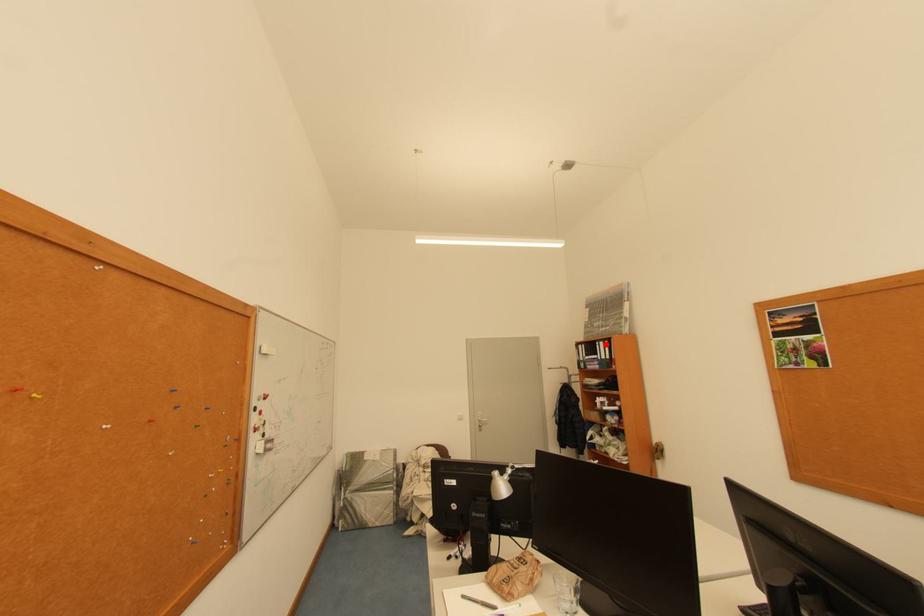
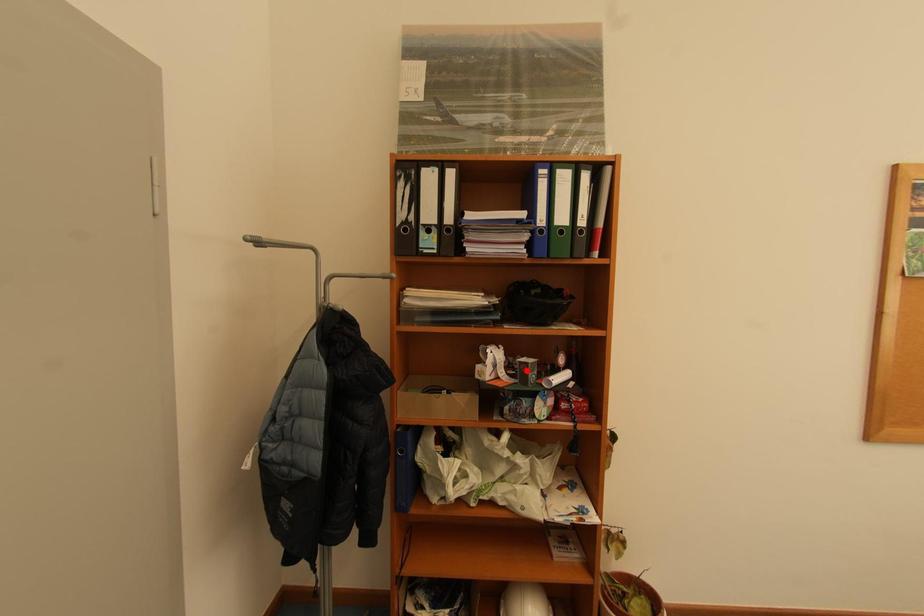
I am providing you with two images of the same scene from different viewpoints. A red point is marked on the first image and another point is marked on the second image. Are the points marked in image1 and image2 representing the same 3D position?

No